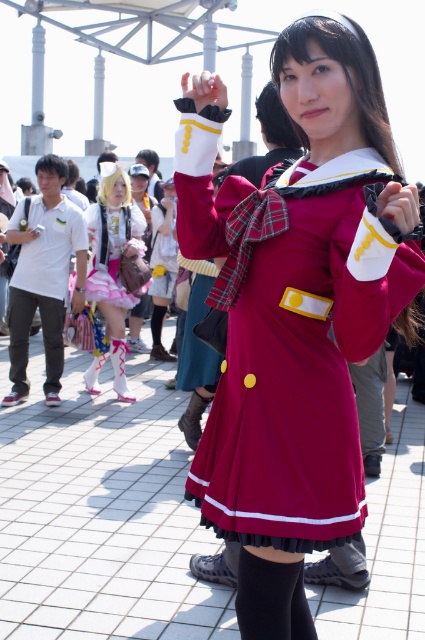
Question: Which of the following is the closest to the observer?

Choices:
 (A) black cotton pants at left
 (B) pastel pink satin dress at center
 (C) matte red dress at center

Answer: (C)

Question: Can you confirm if pastel pink satin dress at center is thinner than black cotton pants at left?

Choices:
 (A) no
 (B) yes

Answer: (A)

Question: Is matte red dress at center thinner than pastel chiffon dress at center?

Choices:
 (A) yes
 (B) no

Answer: (B)

Question: Which object is the closest to the pastel chiffon dress at center?

Choices:
 (A) pastel pink satin dress at center
 (B) matte red dress at center
 (C) black cotton pants at left

Answer: (A)

Question: Which object is the farthest from the black cotton pants at left?

Choices:
 (A) matte red dress at center
 (B) pastel chiffon dress at center

Answer: (A)

Question: Does pastel chiffon dress at center have a greater width compared to black cotton pants at left?

Choices:
 (A) no
 (B) yes

Answer: (B)